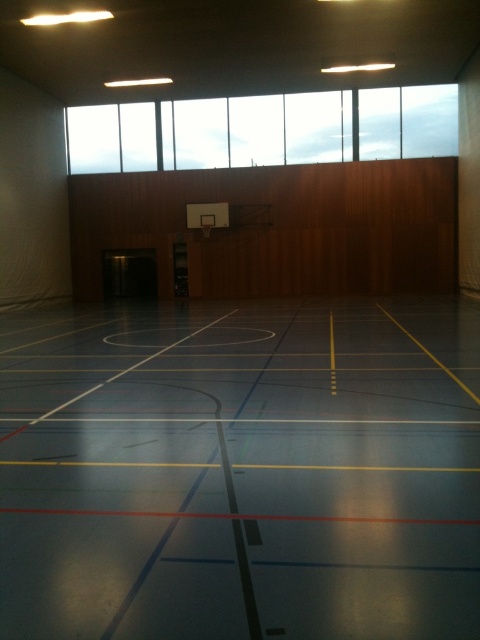
Question: Is transparent glass windows at upper center wider than metallic silver basketball hoop at center?

Choices:
 (A) no
 (B) yes

Answer: (B)

Question: Among these points, which one is nearest to the camera?

Choices:
 (A) (204, 227)
 (B) (120, 125)

Answer: (A)

Question: Can you confirm if transparent glass windows at upper center is positioned to the right of metallic silver basketball hoop at center?

Choices:
 (A) no
 (B) yes

Answer: (B)

Question: Can you confirm if transparent glass windows at upper center is positioned above metallic silver basketball hoop at center?

Choices:
 (A) yes
 (B) no

Answer: (A)

Question: Which point is closer to the camera?

Choices:
 (A) transparent glass windows at upper center
 (B) metallic silver basketball hoop at center

Answer: (B)